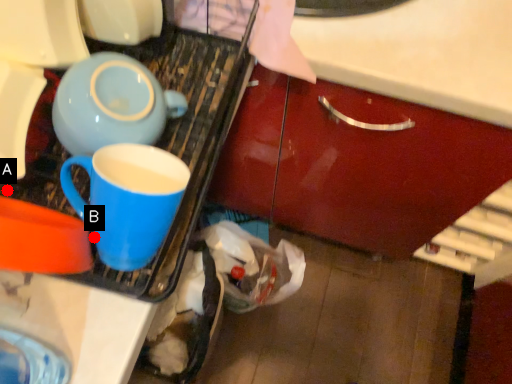
Question: Two points are circled on the image, labeled by A and B beside each circle. Which point appears closest to the camera in this image?

Choices:
 (A) A is closer
 (B) B is closer

Answer: (B)